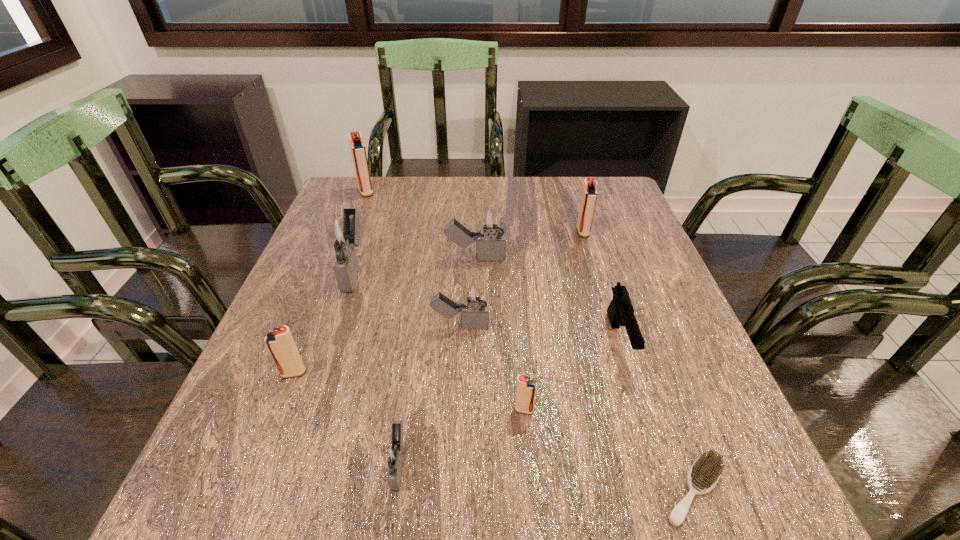
Select which igniter appears as the second closest to the biggest red igniter. Please provide its 2D coordinates. Your answer should be formatted as a tuple, i.e. [(x, y)], where the tuple contains the x and y coordinates of a point satisfying the conditions above.

[(490, 222)]

Choose which red igniter is the third nearest neighbor to the third biggest red igniter. Please provide its 2D coordinates. Your answer should be formatted as a tuple, i.e. [(x, y)], where the tuple contains the x and y coordinates of a point satisfying the conditions above.

[(589, 194)]

Choose which red igniter is the nearest neighbor to the third farthest red igniter. Please provide its 2D coordinates. Your answer should be formatted as a tuple, i.e. [(x, y)], where the tuple contains the x and y coordinates of a point satisfying the conditions above.

[(526, 388)]

Image resolution: width=960 pixels, height=540 pixels. I want to click on gray igniter that is the second closest to the shortest object, so click(395, 456).

The height and width of the screenshot is (540, 960). Identify the location of gray igniter that is the nearest to the nearest igniter. (475, 315).

Locate an element on the screen. vacant region that satisfies the following two spatial constraints: 1. on the front side of the biggest gray igniter; 2. on the left side of the biggest red igniter is located at coordinates (337, 269).

Find the location of a particular element. vacant space that satisfies the following two spatial constraints: 1. on the back side of the leftmost gray igniter; 2. on the right side of the third biggest red igniter is located at coordinates tap(334, 269).

At what (x,y) coordinates should I click in order to perform the action: click on vacant point that satisfies the following two spatial constraints: 1. on the back side of the second farthest object; 2. on the left side of the sixth farthest igniter. Please return your answer as a coordinate pair (x, y). The height and width of the screenshot is (540, 960). Looking at the image, I should click on (348, 232).